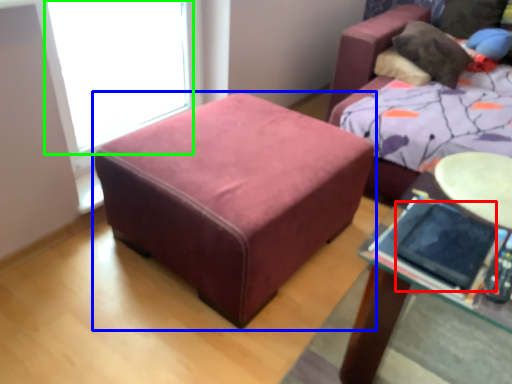
Question: Estimate the real-world distances between objects in this image. Which object is closer to ipad (highlighted by a red box), table (highlighted by a blue box) or window screen (highlighted by a green box)?

Choices:
 (A) table
 (B) window screen

Answer: (A)